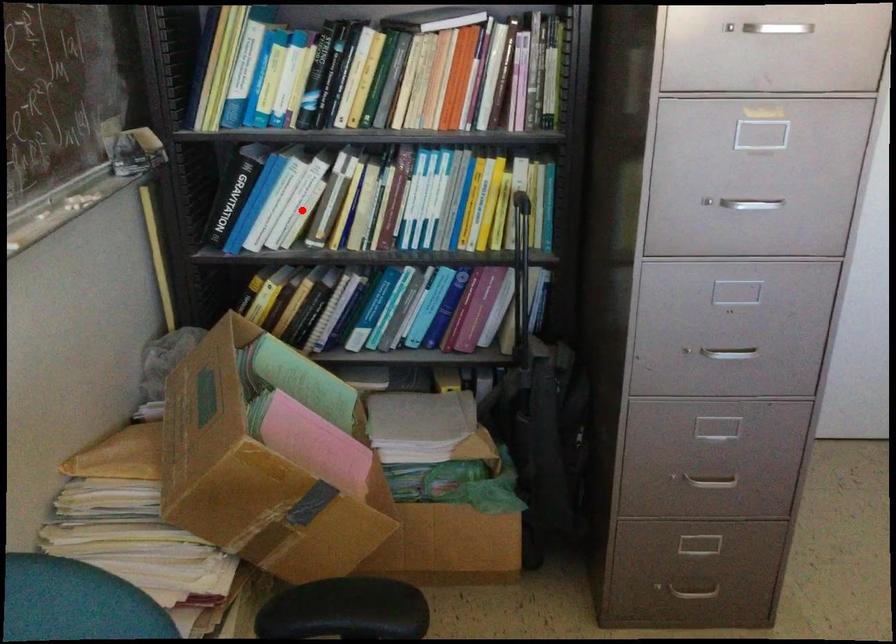
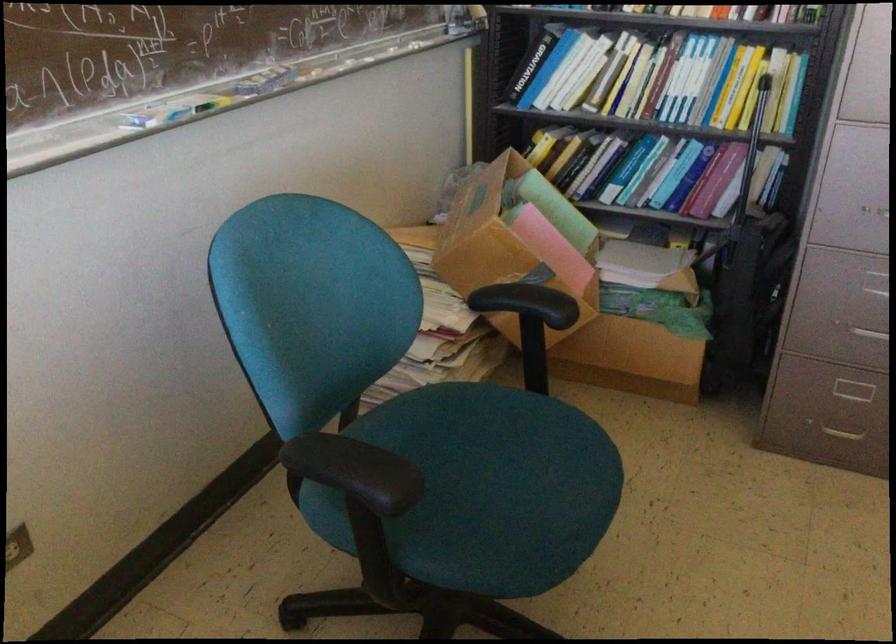
Locate, in the second image, the point that corresponds to the highlighted location in the first image.

(583, 77)